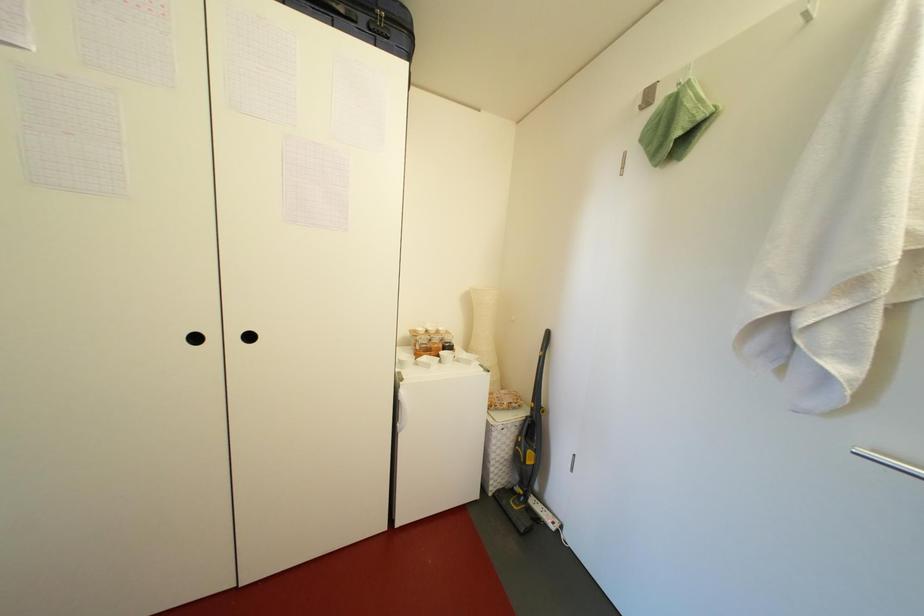
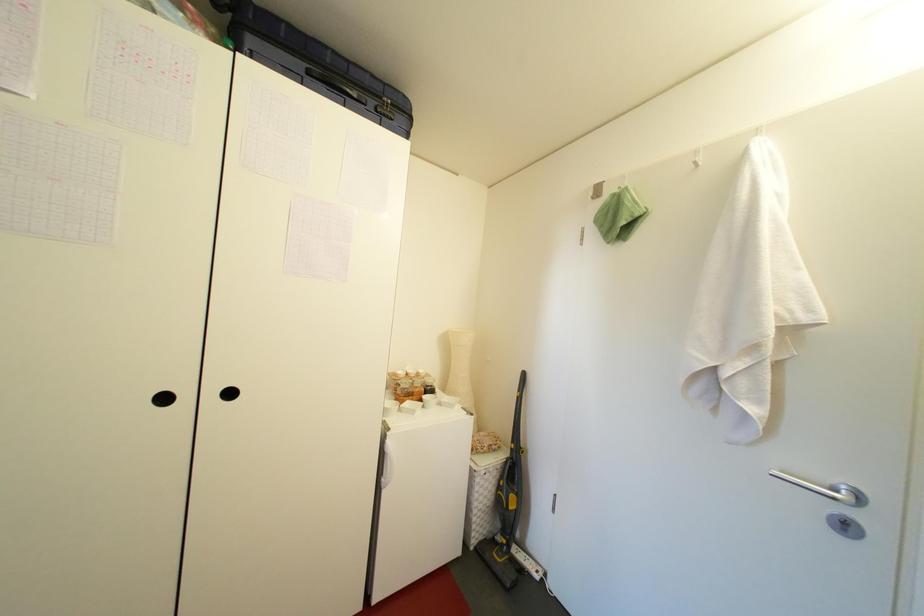
Question: Based on the continuous images, in which direction is the camera rotating? Reply with the corresponding letter.

Choices:
 (A) Left
 (B) Right
 (C) Up
 (D) Down

Answer: (B)